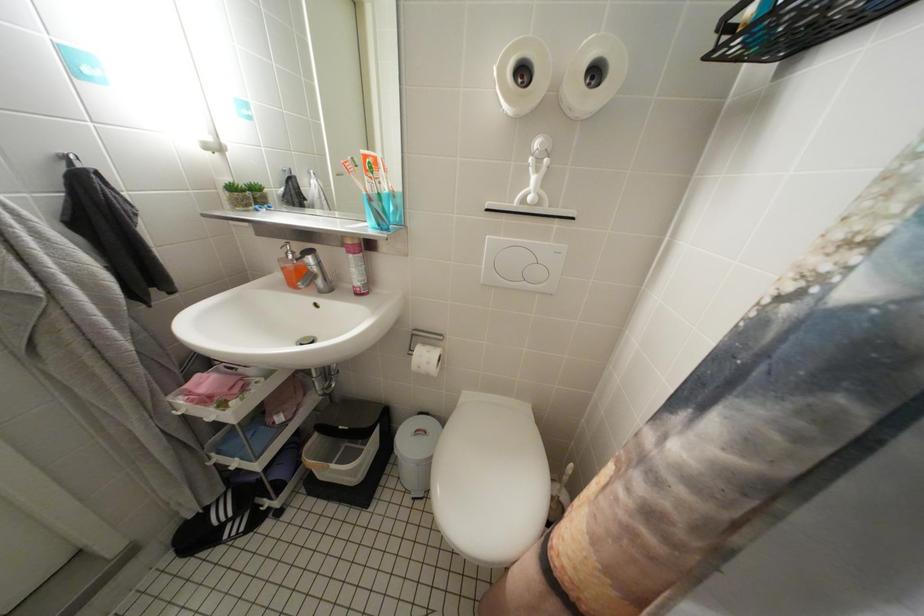
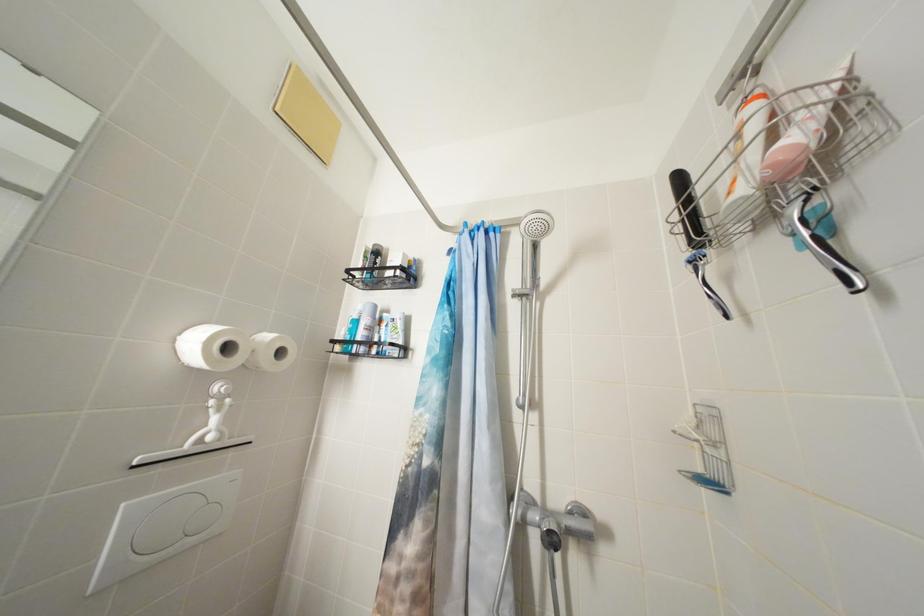
Question: The first image is from the beginning of the video and the second image is from the end. How did the camera likely rotate when shooting the video?

Choices:
 (A) Left
 (B) Right
 (C) Up
 (D) Down

Answer: (B)